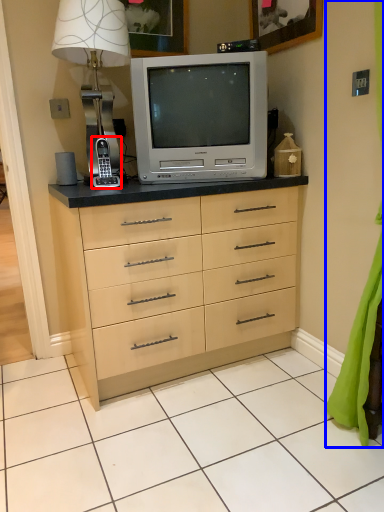
Question: Which of the following is the closest to the observer, gadget (highlighted by a red box) or curtain (highlighted by a blue box)?

Choices:
 (A) gadget
 (B) curtain

Answer: (B)